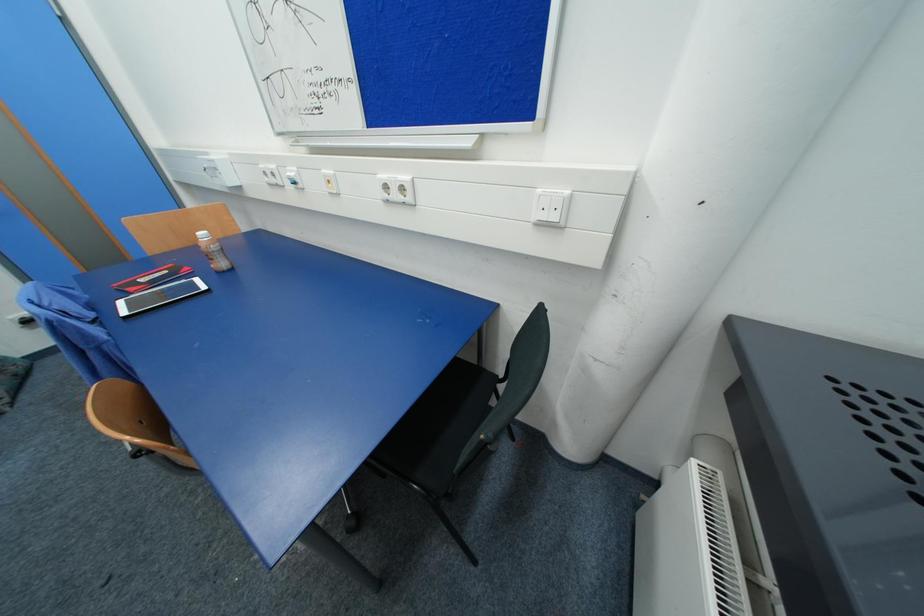
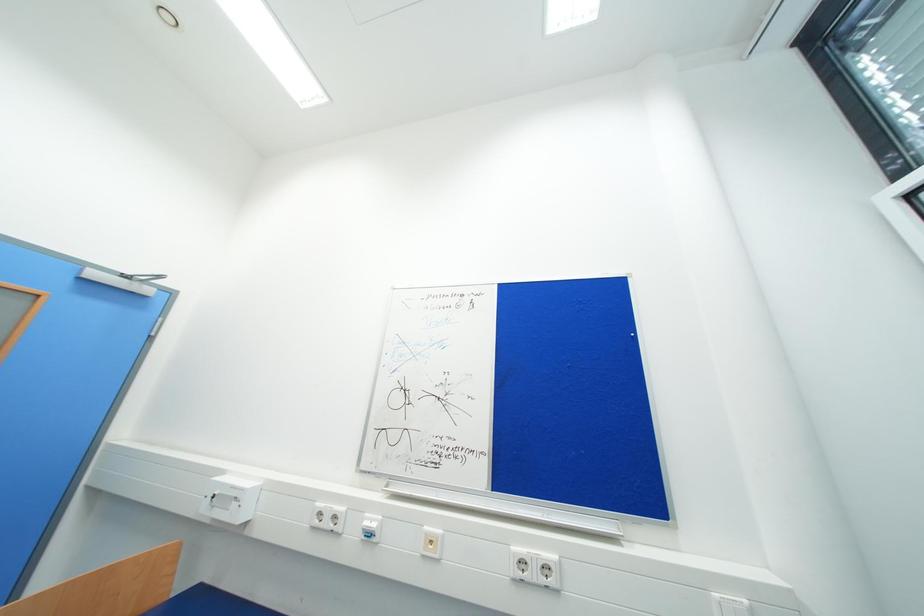
How did the camera likely rotate?

The rotation direction of the camera is right-up.